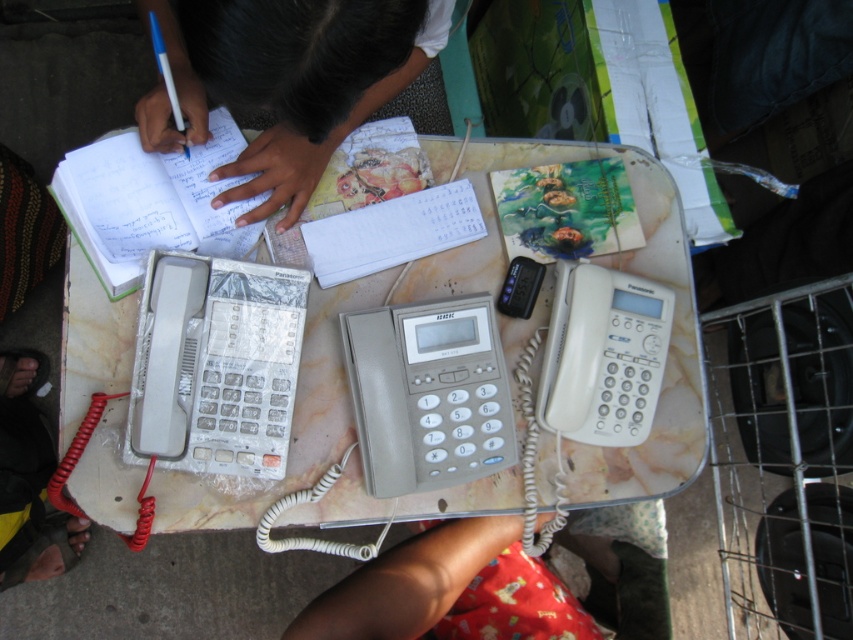
Can you confirm if gray plastic calculator at center is smaller than black fabric foot at lower left?

Yes.

Is gray plastic calculator at center above black fabric foot at lower left?

Indeed, gray plastic calculator at center is positioned over black fabric foot at lower left.

Is point (345, 340) positioned behind point (36, 504)?

No, (345, 340) is closer to viewer.

This screenshot has height=640, width=853. In order to click on gray plastic calculator at center in this screenshot , I will do `click(428, 394)`.

Can you confirm if clear plastic calculator at left is wider than black plastic phone at center?

Yes, clear plastic calculator at left is wider than black plastic phone at center.

What do you see at coordinates (216, 365) in the screenshot?
I see `clear plastic calculator at left` at bounding box center [216, 365].

What are the coordinates of `clear plastic calculator at left` in the screenshot? It's located at (216, 365).

The image size is (853, 640). I want to click on clear plastic calculator at left, so click(216, 365).

Does point (4, 444) lie in front of point (532, 292)?

No, it is behind (532, 292).

Find the location of a particular element. The image size is (853, 640). black fabric foot at lower left is located at coordinates point(28,480).